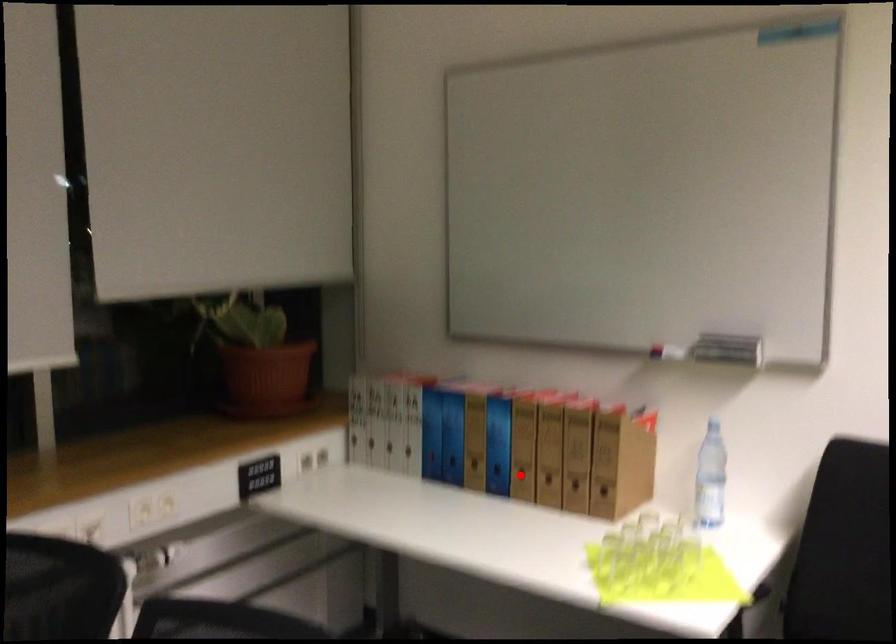
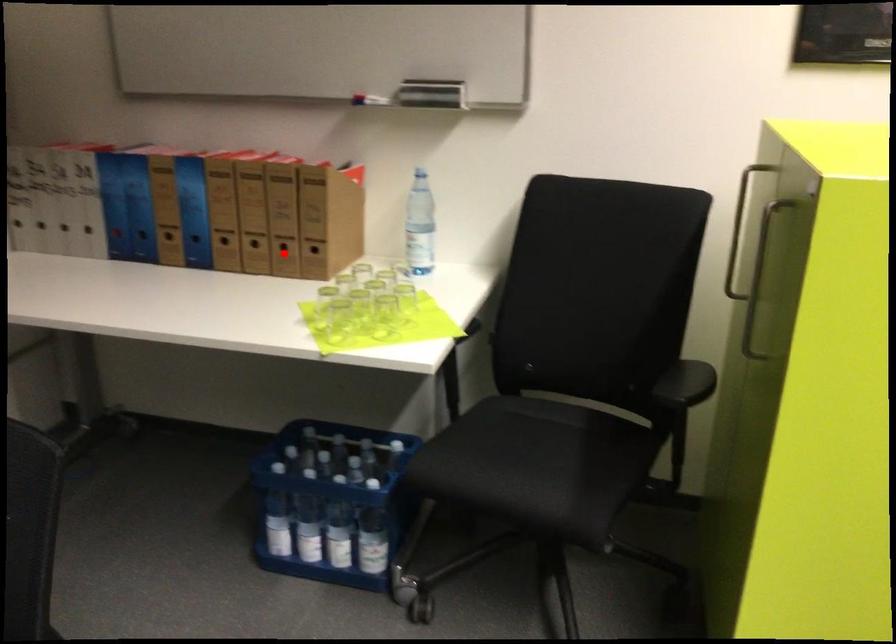
I am providing you with two images of the same scene from different viewpoints. A red point is marked on the first image and another point is marked on the second image. Is the red point in image1 aligned with the point shown in image2?

No